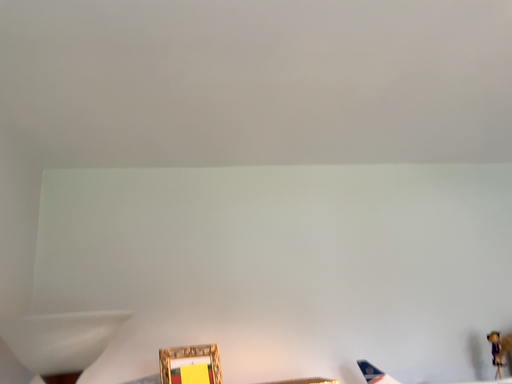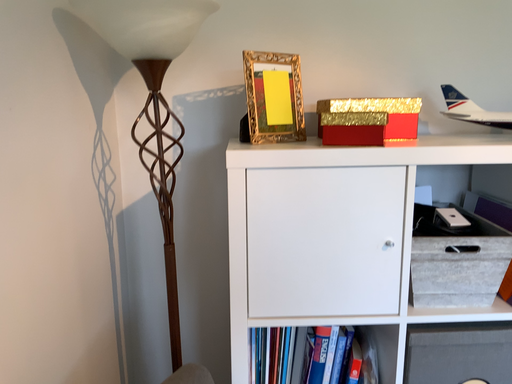
Question: Which way did the camera rotate in the video?

Choices:
 (A) rotated left
 (B) rotated right

Answer: (A)